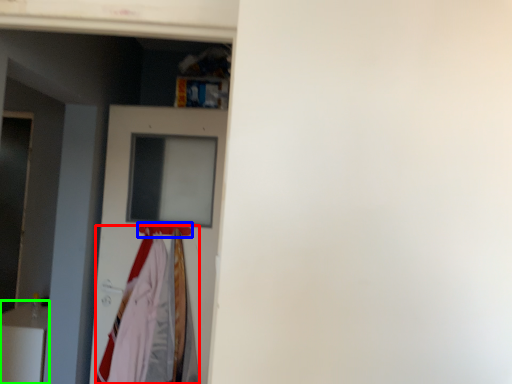
Question: Estimate the real-world distances between objects in this image. Which object is farther from clothing (highlighted by a red box), hanger (highlighted by a blue box) or furniture (highlighted by a green box)?

Choices:
 (A) hanger
 (B) furniture

Answer: (B)